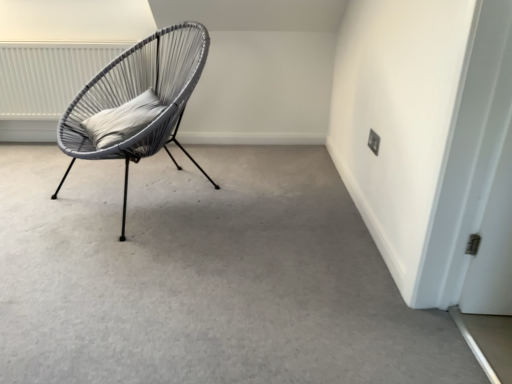
Locate an element on the screen. The height and width of the screenshot is (384, 512). free point below matte grey wicker chair at left (from a real-world perspective) is located at coordinates (152, 186).